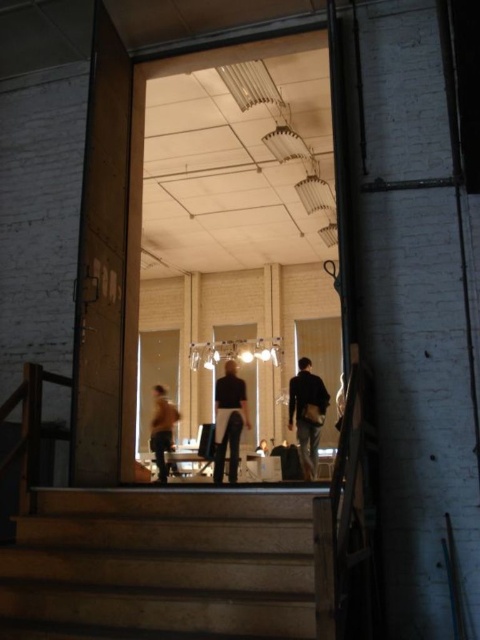
Who is more distant from viewer, (168, 564) or (166, 465)?

The point (166, 465) is behind.

Who is taller, brown wooden stairs at lower left or orange fabric jacket at lower left?

orange fabric jacket at lower left is taller.

Who is more forward, (x=307, y=540) or (x=157, y=452)?

Point (x=307, y=540) is more forward.

Where is `brown wooden stairs at lower left`? The image size is (480, 640). brown wooden stairs at lower left is located at coordinates (162, 564).

Measure the distance between dark fabric jacket at center and camera.

dark fabric jacket at center and camera are 7.33 meters apart.

Between dark fabric jacket at center and dark gray pants at center, which one has more height?

With more height is dark fabric jacket at center.

This screenshot has width=480, height=640. What do you see at coordinates (307, 413) in the screenshot? I see `dark fabric jacket at center` at bounding box center [307, 413].

The width and height of the screenshot is (480, 640). I want to click on dark fabric jacket at center, so click(307, 413).

Can you confirm if dark fabric jacket at center is positioned to the right of orange fabric jacket at lower left?

Indeed, dark fabric jacket at center is positioned on the right side of orange fabric jacket at lower left.

Which is above, dark fabric jacket at center or orange fabric jacket at lower left?

dark fabric jacket at center

Find the location of a particular element. Image resolution: width=480 pixels, height=640 pixels. dark fabric jacket at center is located at coordinates (307, 413).

What are the coordinates of `dark fabric jacket at center` in the screenshot? It's located at (307, 413).